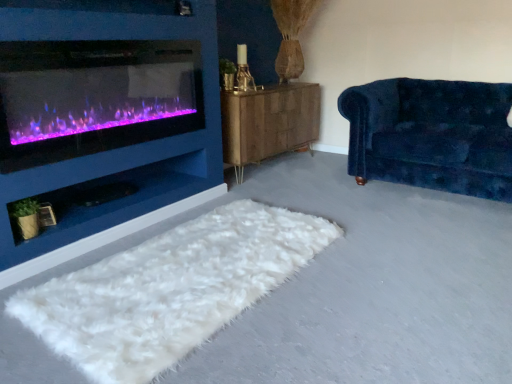
Where is `free space above purple glass wood burning stove at left (from a real-world perspective)`? Image resolution: width=512 pixels, height=384 pixels. free space above purple glass wood burning stove at left (from a real-world perspective) is located at coordinates (109, 33).